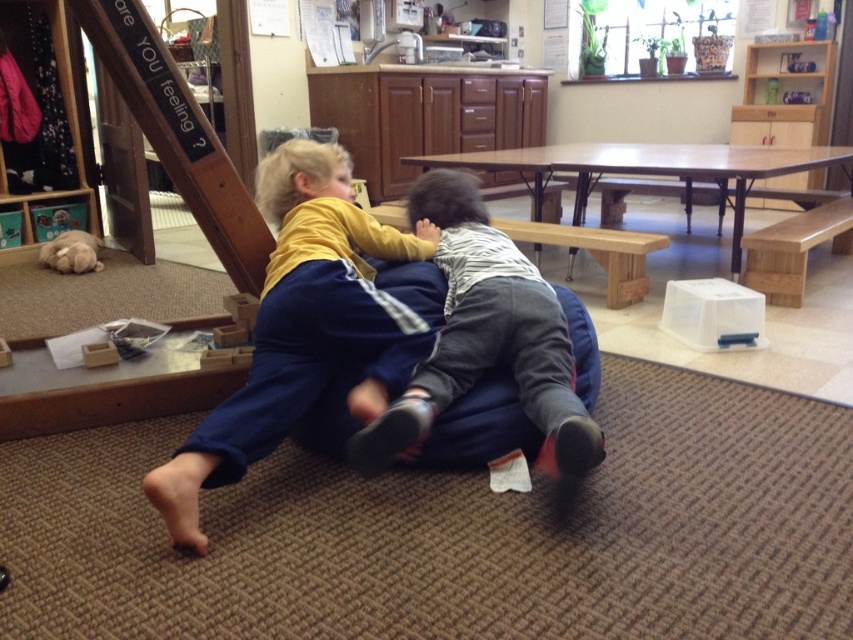
Question: Does matte yellow shirt at center appear under striped cotton shirt at center?

Choices:
 (A) no
 (B) yes

Answer: (B)

Question: Can you confirm if matte yellow shirt at center is wider than striped cotton shirt at center?

Choices:
 (A) no
 (B) yes

Answer: (B)

Question: Which of the following is the farthest from the observer?

Choices:
 (A) striped cotton shirt at center
 (B) matte yellow shirt at center

Answer: (A)

Question: Does matte yellow shirt at center appear over striped cotton shirt at center?

Choices:
 (A) yes
 (B) no

Answer: (B)

Question: Which point is closer to the camera?

Choices:
 (A) striped cotton shirt at center
 (B) matte yellow shirt at center

Answer: (B)

Question: Among these points, which one is farthest from the camera?

Choices:
 (A) (430, 376)
 (B) (344, 241)

Answer: (B)